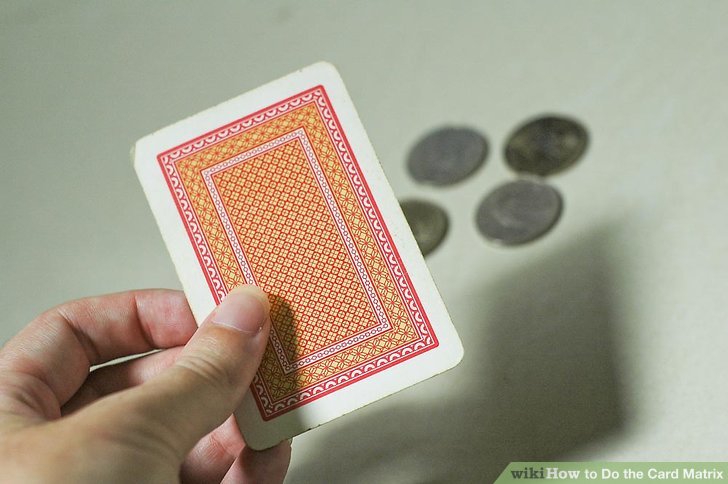
Locate an element on the screen. The height and width of the screenshot is (484, 728). white table is located at coordinates (82, 199), (630, 169).